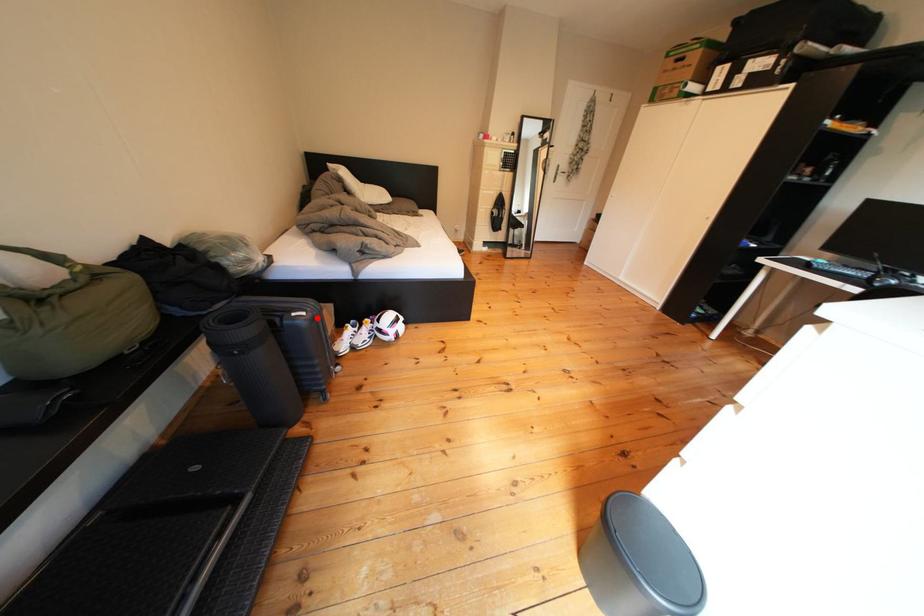
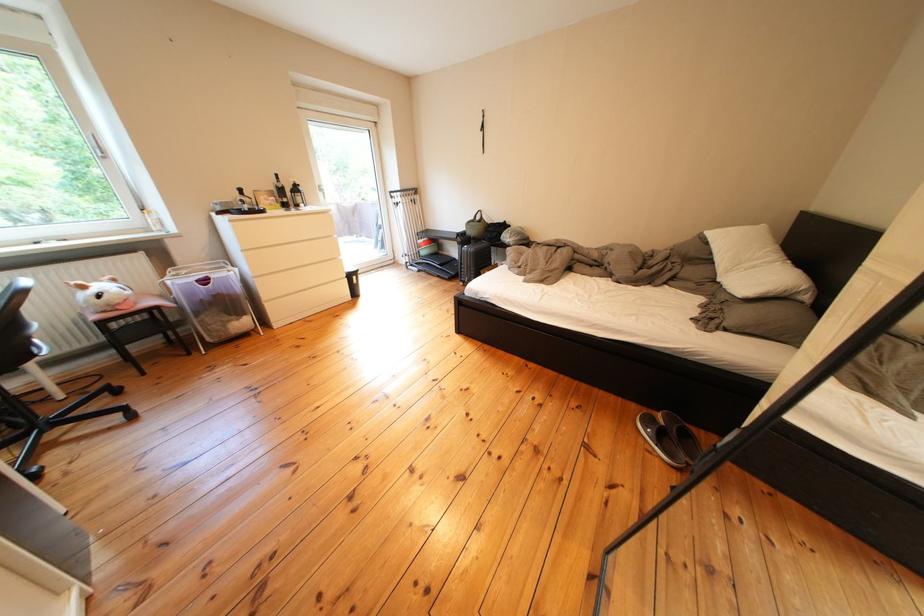
Where in the second image is the point corresponding to the highlighted location from the first image?

(479, 252)